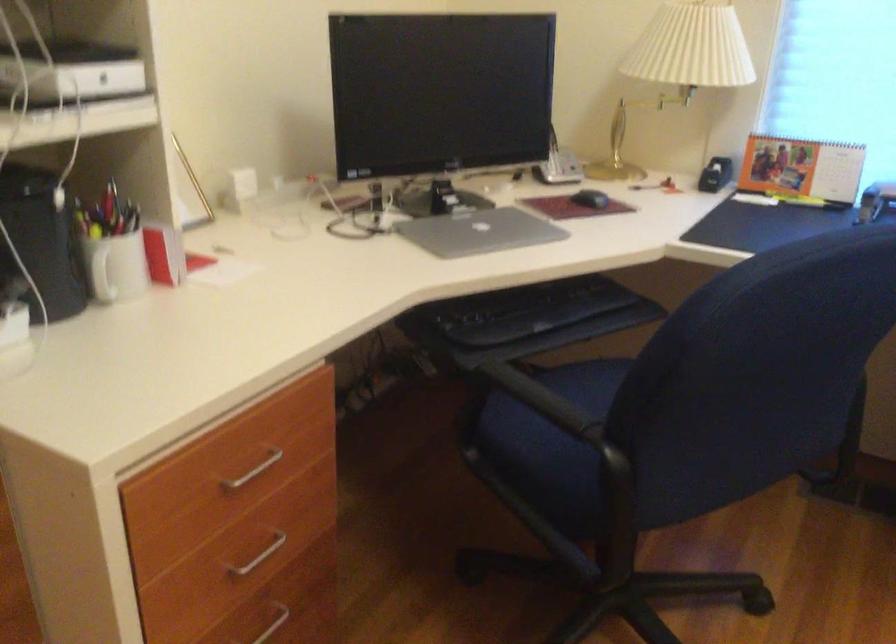
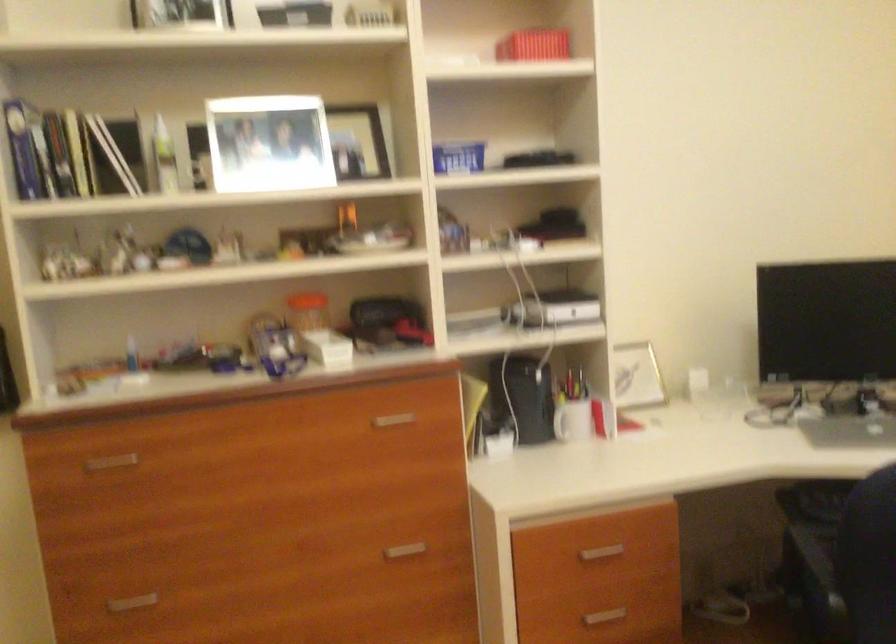
Question: The camera is either moving clockwise (left) or counter-clockwise (right) around the object. The first image is from the beginning of the video and the second image is from the end. Is the camera moving left or right when shooting the video?

Choices:
 (A) Left
 (B) Right

Answer: (B)